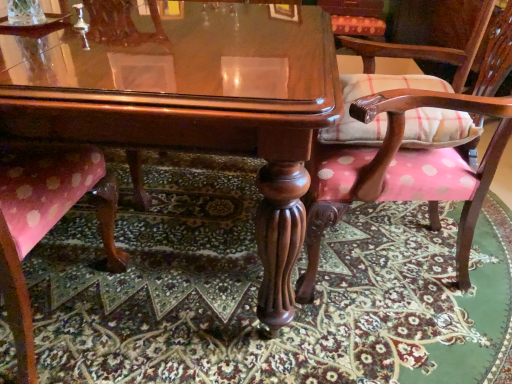
Question: Can you confirm if pink polka dot fabric at lower center is smaller than pink polka dot fabric chair at center, the 2th chair viewed from the back?

Choices:
 (A) no
 (B) yes

Answer: (B)

Question: Is pink polka dot fabric at lower center taller than pink polka dot fabric chair at center, the 2th chair in the front-to-back sequence?

Choices:
 (A) no
 (B) yes

Answer: (A)

Question: Considering the relative sizes of pink polka dot fabric at lower center and pink polka dot fabric chair at center, the 2th chair viewed from the back, in the image provided, is pink polka dot fabric at lower center bigger than pink polka dot fabric chair at center, the 2th chair viewed from the back,?

Choices:
 (A) no
 (B) yes

Answer: (A)

Question: From a real-world perspective, does pink polka dot fabric at lower center stand above pink polka dot fabric chair at center, marked as the second chair in a right-to-left arrangement?

Choices:
 (A) yes
 (B) no

Answer: (B)

Question: From the image's perspective, does pink polka dot fabric at lower center appear lower than pink polka dot fabric chair at center, marked as the 2th chair in a left-to-right arrangement?

Choices:
 (A) no
 (B) yes

Answer: (B)

Question: Is pink polka dot fabric chair at lower left, which is counted as the 1th chair, starting from the front, inside the boundaries of pink polka dot fabric chair at center, marked as the second chair in a right-to-left arrangement, or outside?

Choices:
 (A) outside
 (B) inside

Answer: (A)

Question: From a real-world perspective, relative to pink polka dot fabric chair at center, the 2th chair viewed from the back, is pink polka dot fabric chair at lower left, which is counted as the 1th chair, starting from the front, vertically above or below?

Choices:
 (A) above
 (B) below

Answer: (B)

Question: From their relative heights in the image, would you say pink polka dot fabric chair at lower left, which is counted as the 1th chair, starting from the front, is taller or shorter than pink polka dot fabric chair at center, marked as the second chair in a right-to-left arrangement?

Choices:
 (A) tall
 (B) short

Answer: (B)

Question: Does point (33, 349) appear closer or farther from the camera than point (501, 79)?

Choices:
 (A) farther
 (B) closer

Answer: (B)

Question: Is pink polka dot fabric chair at center, the 2th chair viewed from the back, bigger or smaller than pink polka dot fabric chair at lower left, which is counted as the 1th chair, starting from the front?

Choices:
 (A) small
 (B) big

Answer: (B)

Question: From the image's perspective, is pink polka dot fabric chair at center, marked as the 2th chair in a left-to-right arrangement, positioned above or below pink polka dot fabric chair at lower left, the 3th chair when ordered from right to left?

Choices:
 (A) below
 (B) above

Answer: (B)

Question: Do you think pink polka dot fabric chair at center, the 2th chair in the front-to-back sequence, is within pink polka dot fabric chair at lower left, which is counted as the 1th chair, starting from the left, or outside of it?

Choices:
 (A) inside
 (B) outside

Answer: (B)

Question: From a real-world perspective, is pink polka dot fabric chair at center, marked as the second chair in a right-to-left arrangement, physically located above or below pink polka dot fabric chair at lower left, acting as the third chair starting from the back?

Choices:
 (A) below
 (B) above

Answer: (B)

Question: From their relative heights in the image, would you say pink polka dot fabric chair at lower left, acting as the third chair starting from the back, is taller or shorter than glossy wood table at center?

Choices:
 (A) tall
 (B) short

Answer: (A)

Question: Is pink polka dot fabric chair at lower left, the 3th chair when ordered from right to left, inside the boundaries of glossy wood table at center, or outside?

Choices:
 (A) outside
 (B) inside

Answer: (B)